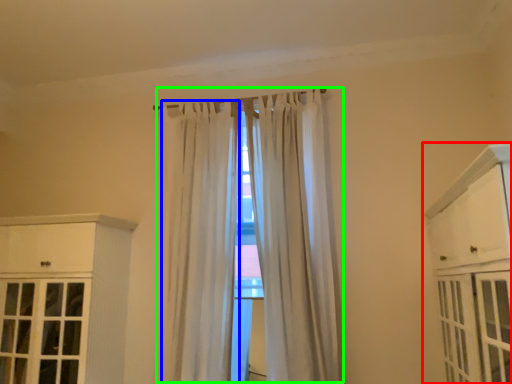
Question: Estimate the real-world distances between objects in this image. Which object is farther from cabinetry (highlighted by a red box), curtain (highlighted by a blue box) or curtain (highlighted by a green box)?

Choices:
 (A) curtain
 (B) curtain

Answer: (A)